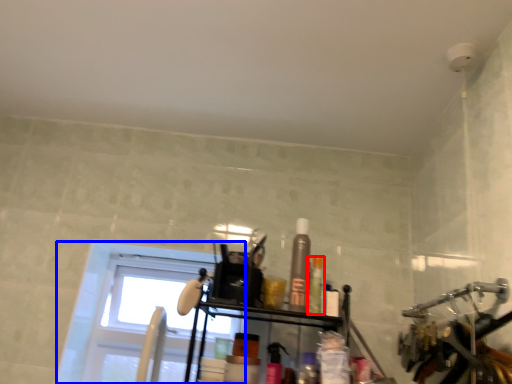
Question: Which point is further to the camera, toiletry (highlighted by a red box) or window (highlighted by a blue box)?

Choices:
 (A) toiletry
 (B) window

Answer: (B)